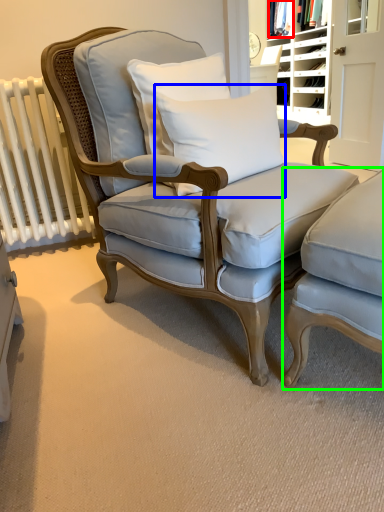
Question: Estimate the real-world distances between objects in this image. Which object is farther from fabric (highlighted by a red box), pillow (highlighted by a blue box) or chair (highlighted by a green box)?

Choices:
 (A) pillow
 (B) chair

Answer: (B)